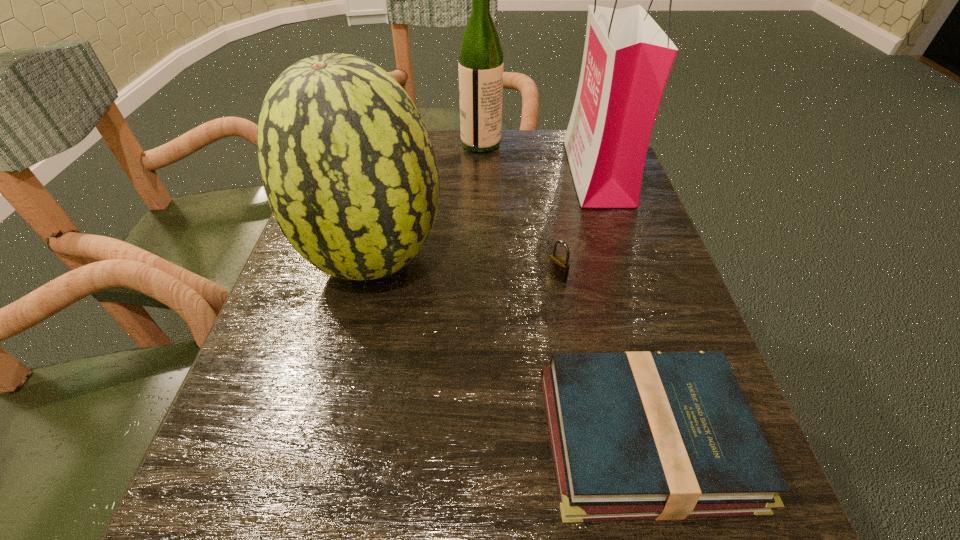
Image resolution: width=960 pixels, height=540 pixels. What are the coordinates of `hardback book situated at the right edge` in the screenshot? It's located at (642, 435).

At what (x,y) coordinates should I click in order to perform the action: click on object that is at the far right corner. Please return your answer as a coordinate pair (x, y). Looking at the image, I should click on (627, 59).

This screenshot has width=960, height=540. Find the location of `object that is at the near right corner`. object that is at the near right corner is located at coordinates (642, 435).

In the image, there is a desktop. In order to click on vacant space at the far edge in this screenshot , I will do `click(449, 180)`.

Identify the location of free space at the near edge. This screenshot has width=960, height=540. (426, 494).

I want to click on free space at the left edge of the desktop, so click(280, 357).

At what (x,y) coordinates should I click in order to perform the action: click on vacant space at the right edge of the desktop. Please return your answer as a coordinate pair (x, y). The image size is (960, 540). Looking at the image, I should click on (637, 311).

In the image, there is a desktop. Where is `vacant space at the near left corner`? The image size is (960, 540). vacant space at the near left corner is located at coordinates (219, 533).

The width and height of the screenshot is (960, 540). Identify the location of free space between the hardback book and the leftmost object. (509, 349).

Find the location of `empty space that is in between the shopping bag and the hardback book`. empty space that is in between the shopping bag and the hardback book is located at coordinates (620, 305).